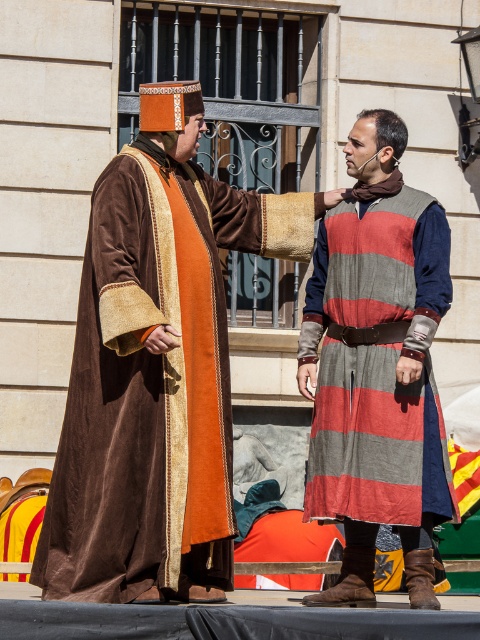
Which is more to the right, velvet brown robe at left or striped woolen tunic at center?

Positioned to the right is striped woolen tunic at center.

Between velvet brown robe at left and striped woolen tunic at center, which one is positioned lower?

striped woolen tunic at center is below.

Is point (176, 324) closer to camera compared to point (326, 269)?

Yes, it is.

The height and width of the screenshot is (640, 480). Identify the location of velvet brown robe at left. (156, 369).